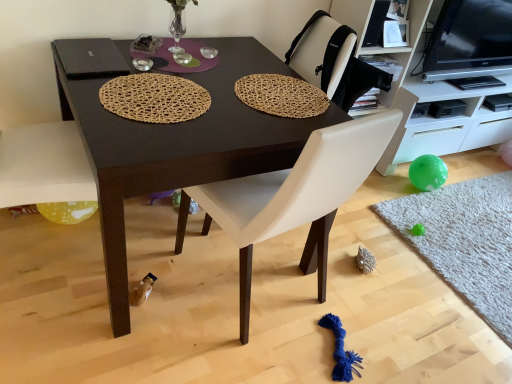
Question: In which direction should I rotate to look at woven natural mat at center, acting as the 3th mat starting from the back?

Choices:
 (A) left
 (B) right

Answer: (A)

Question: Can you confirm if black glossy tv at upper right is positioned to the right of woven natural mat at upper center, acting as the second mat starting from the front?

Choices:
 (A) yes
 (B) no

Answer: (A)

Question: From a real-world perspective, is black glossy tv at upper right physically below woven natural mat at upper center, acting as the second mat starting from the front?

Choices:
 (A) no
 (B) yes

Answer: (A)

Question: Is black glossy tv at upper right outside woven natural mat at upper center, the second mat when ordered from back to front?

Choices:
 (A) yes
 (B) no

Answer: (A)

Question: Is black glossy tv at upper right to the left of woven natural mat at upper center, acting as the second mat starting from the front, from the viewer's perspective?

Choices:
 (A) no
 (B) yes

Answer: (A)

Question: Is the position of black glossy tv at upper right less distant than that of woven natural mat at upper center, arranged as the 2th mat when viewed from the left?

Choices:
 (A) yes
 (B) no

Answer: (B)

Question: Is black glossy tv at upper right taller than woven natural mat at upper center, which is the second mat in right-to-left order?

Choices:
 (A) yes
 (B) no

Answer: (A)

Question: Is white leather chair at center to the right of woven natural mat at upper center, acting as the third mat starting from the bottom, from the viewer's perspective?

Choices:
 (A) yes
 (B) no

Answer: (B)

Question: Is white leather chair at center oriented towards woven natural mat at upper center, acting as the third mat starting from the bottom?

Choices:
 (A) yes
 (B) no

Answer: (A)

Question: Would you say woven natural mat at upper center, the 1th mat when ordered from top to bottom, is part of white leather chair at center's contents?

Choices:
 (A) yes
 (B) no

Answer: (A)

Question: Is white leather chair at center next to woven natural mat at upper center, arranged as the 2th mat when viewed from the left, and touching it?

Choices:
 (A) yes
 (B) no

Answer: (B)

Question: Is white leather chair at center thinner than woven natural mat at upper center, acting as the third mat starting from the bottom?

Choices:
 (A) no
 (B) yes

Answer: (A)

Question: Considering the relative sizes of white leather chair at center and woven natural mat at upper center, the second mat when ordered from back to front, in the image provided, is white leather chair at center wider than woven natural mat at upper center, the second mat when ordered from back to front,?

Choices:
 (A) no
 (B) yes

Answer: (B)

Question: Is dark brown wood table at center turned away from white leather chair at center?

Choices:
 (A) no
 (B) yes

Answer: (A)